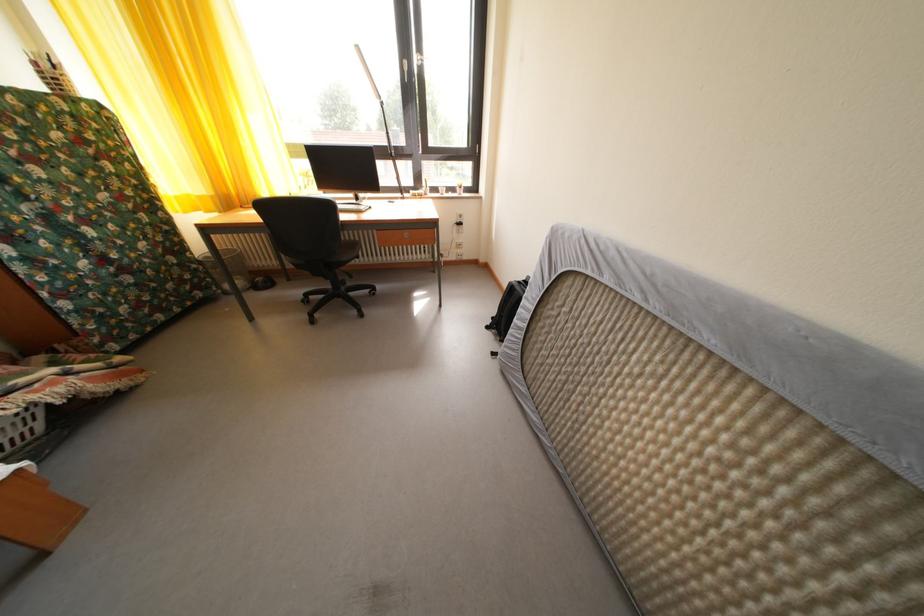
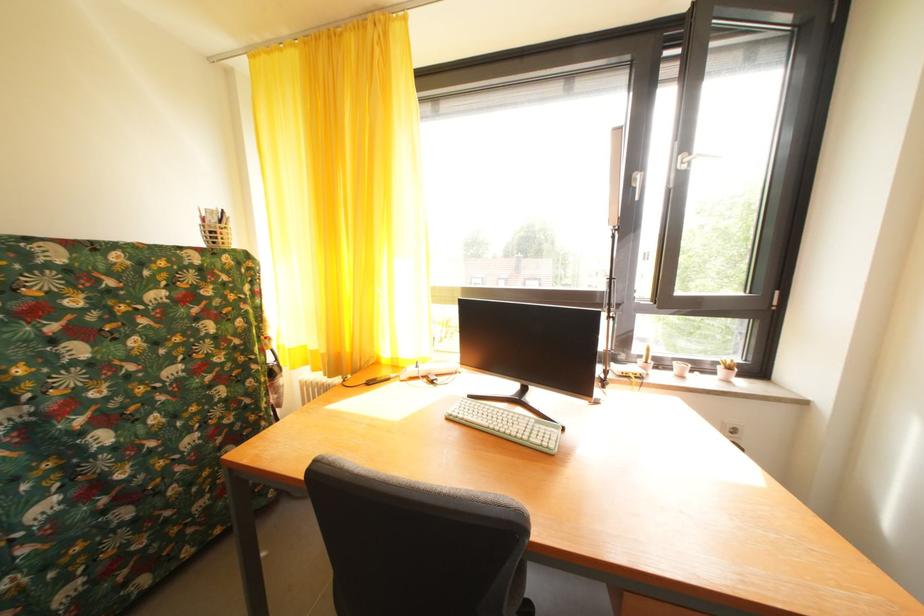
Find the pixel in the second image that matches pixel 467 195 in the first image.

(728, 374)